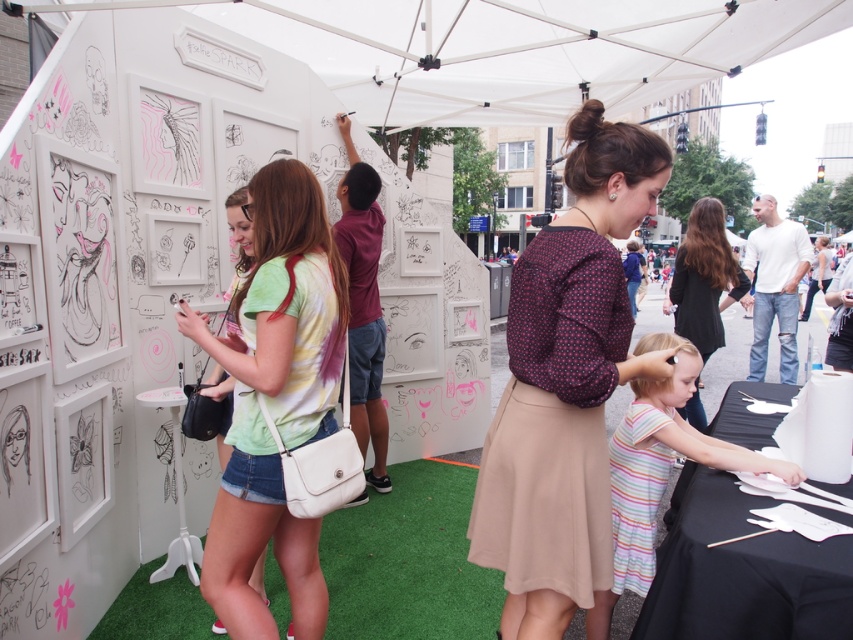
Is white fabric canopy at upper center below striped cotton dress at lower center?

Actually, white fabric canopy at upper center is above striped cotton dress at lower center.

Who is taller, white fabric canopy at upper center or striped cotton dress at lower center?

white fabric canopy at upper center is taller.

Consider the image. Who is more forward, (463, 44) or (664, 474)?

Point (664, 474) is more forward.

Identify the location of white fabric canopy at upper center. click(x=508, y=49).

Which of these two, white fabric canopy at upper center or matte black blouse at center, stands shorter?

white fabric canopy at upper center is shorter.

Can you confirm if white fabric canopy at upper center is smaller than matte black blouse at center?

Actually, white fabric canopy at upper center might be larger than matte black blouse at center.

Locate an element on the screen. This screenshot has height=640, width=853. white fabric canopy at upper center is located at coordinates (508, 49).

Is matte burgundy blouse at center positioned behind striped cotton dress at lower center?

That is False.

Is matte burgundy blouse at center taller than striped cotton dress at lower center?

Yes, matte burgundy blouse at center is taller than striped cotton dress at lower center.

The height and width of the screenshot is (640, 853). Describe the element at coordinates (566, 385) in the screenshot. I see `matte burgundy blouse at center` at that location.

In order to click on matte burgundy blouse at center in this screenshot , I will do `click(566, 385)`.